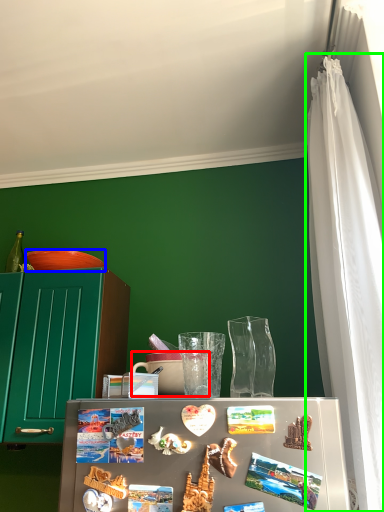
Question: Which is nearer to the coffee cup (highlighted by a red box)? bowl (highlighted by a blue box) or curtain (highlighted by a green box).

Choices:
 (A) bowl
 (B) curtain

Answer: (A)